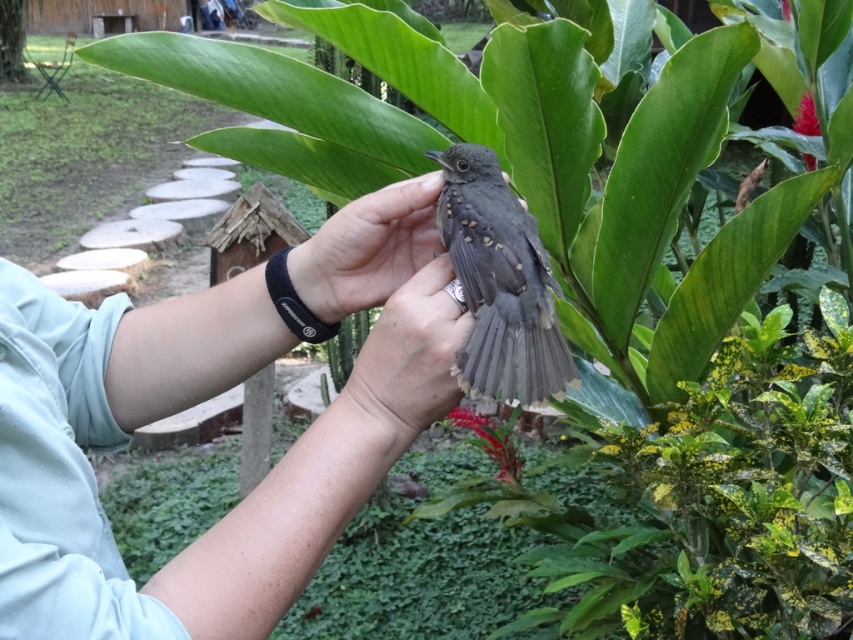
Question: Which of the following is the closest to the observer?

Choices:
 (A) (489, 284)
 (B) (421, 280)
 (C) (10, 397)

Answer: (C)

Question: Which point is closer to the camera?

Choices:
 (A) (321, 276)
 (B) (370, 422)
 (C) (502, 246)
 (D) (323, 531)

Answer: (D)

Question: Is dark gray feathers at center above matte gray hand at center?

Choices:
 (A) yes
 (B) no

Answer: (A)

Question: Does matte gray bird at center have a lesser width compared to matte gray hand at center?

Choices:
 (A) yes
 (B) no

Answer: (B)

Question: Among these points, which one is nearest to the camera?

Choices:
 (A) (415, 179)
 (B) (468, 288)
 (C) (444, 269)

Answer: (B)

Question: Is smooth gray bird at center in front of matte gray bird at center?

Choices:
 (A) no
 (B) yes

Answer: (B)